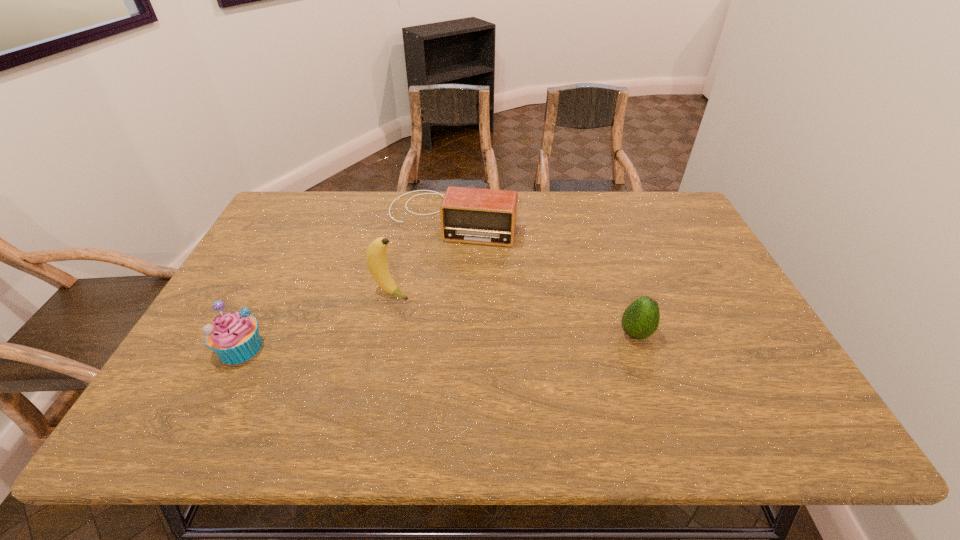
You are a GUI agent. You are given a task and a screenshot of the screen. Output one action in this format:
    pyautogui.click(x=<x>, y=<y>)
    Task: Click on the blank space at the right edge of the desktop
    This screenshot has width=960, height=540.
    Given the screenshot: What is the action you would take?
    pyautogui.click(x=684, y=249)

Locate an element on the screen. The width and height of the screenshot is (960, 540). free space at the near left corner is located at coordinates (204, 379).

Find the location of a particular element. This screenshot has width=960, height=540. vacant space at the far right corner of the desktop is located at coordinates point(634,194).

Locate an element on the screen. blank space at the near right corner of the desktop is located at coordinates (743, 367).

Find the location of a particular element. vacant point located between the muffin and the second farthest object is located at coordinates (316, 320).

Locate an element on the screen. The height and width of the screenshot is (540, 960). vacant area that lies between the radio receiver and the rightmost object is located at coordinates (543, 276).

Locate an element on the screen. The image size is (960, 540). free area in between the radio receiver and the tallest object is located at coordinates (421, 254).

Locate an element on the screen. The width and height of the screenshot is (960, 540). free point between the tallest object and the radio receiver is located at coordinates (421, 254).

The image size is (960, 540). In order to click on vacant area that lies between the radio receiver and the avocado in this screenshot , I will do `click(543, 276)`.

The image size is (960, 540). Find the location of `free point between the muffin and the farthest object`. free point between the muffin and the farthest object is located at coordinates (346, 282).